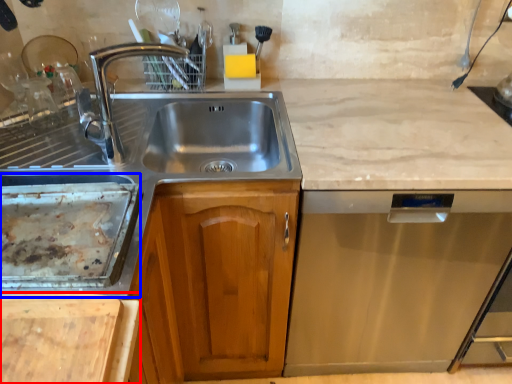
Question: Which object appears farthest to the camera in this image, cutting board (highlighted by a red box) or appliance (highlighted by a blue box)?

Choices:
 (A) cutting board
 (B) appliance

Answer: (B)